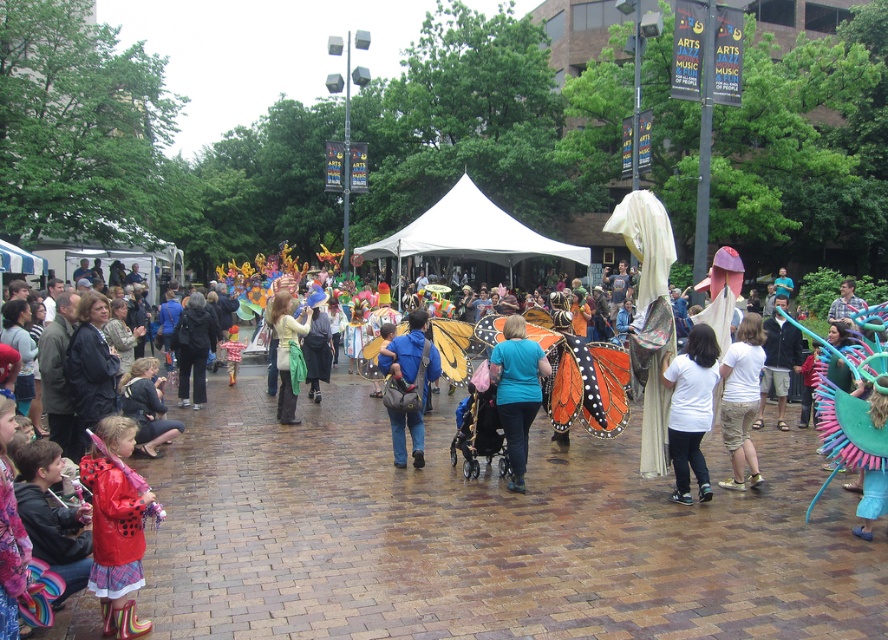
You are organizing a clothing donation drive and need to categorize items by size. You see a blue cotton shirt at center and a matte green scarf at center in the image. Which item has a greater width?

The blue cotton shirt at center has a greater width than the matte green scarf at center.

You are a photographer at the event and want to capture both the blue cotton shirt at center and the matte green scarf at center in one frame. Which object should you focus on first to ensure both are in the shot?

You should focus on the blue cotton shirt at center first because it is larger than the matte green scarf at center, allowing you to frame it properly while still including the smaller scarf in the shot.